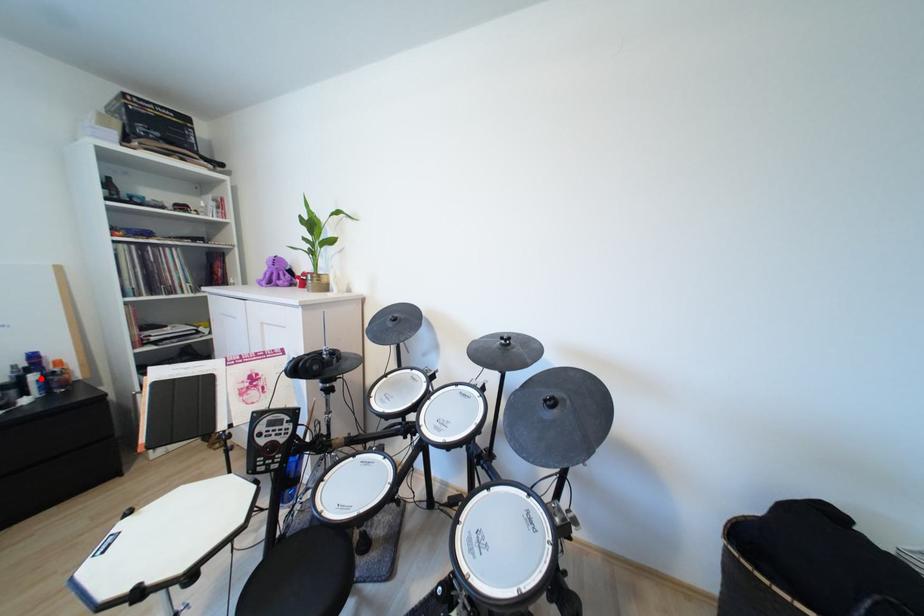
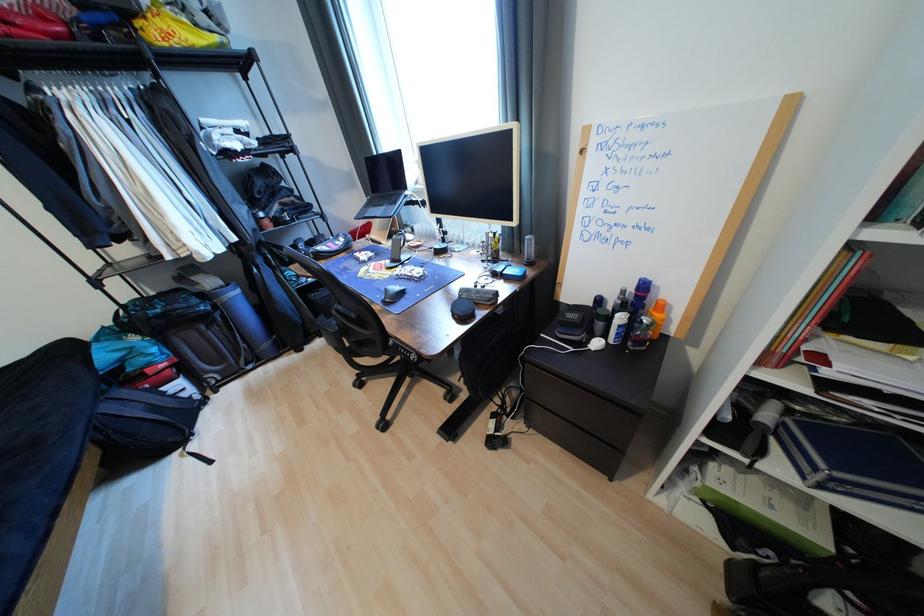
Question: I am providing you with two images of the same scene from different viewpoints. Image1 has a red point marked. In image2, the corresponding 3D location appears at what relative position? Reply with the corresponding letter.

Choices:
 (A) Closer
 (B) Farther

Answer: (A)